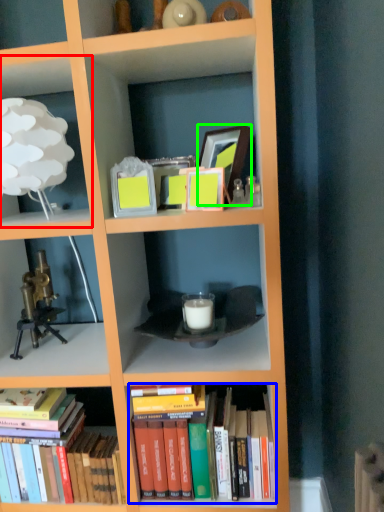
Question: Considering the real-world distances, which object is farthest from shelf (highlighted by a red box)? book (highlighted by a blue box) or picture frame (highlighted by a green box)?

Choices:
 (A) book
 (B) picture frame

Answer: (A)